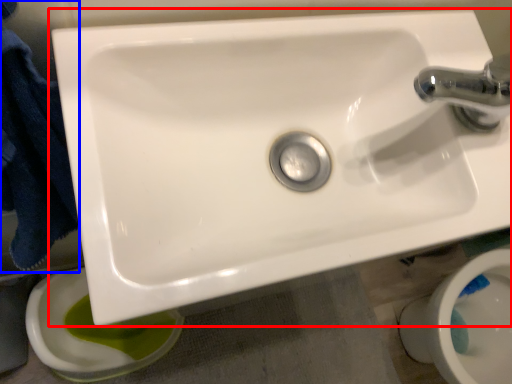
Question: Among these objects, which one is farthest to the camera, sink (highlighted by a red box) or bath towel (highlighted by a blue box)?

Choices:
 (A) sink
 (B) bath towel

Answer: (A)